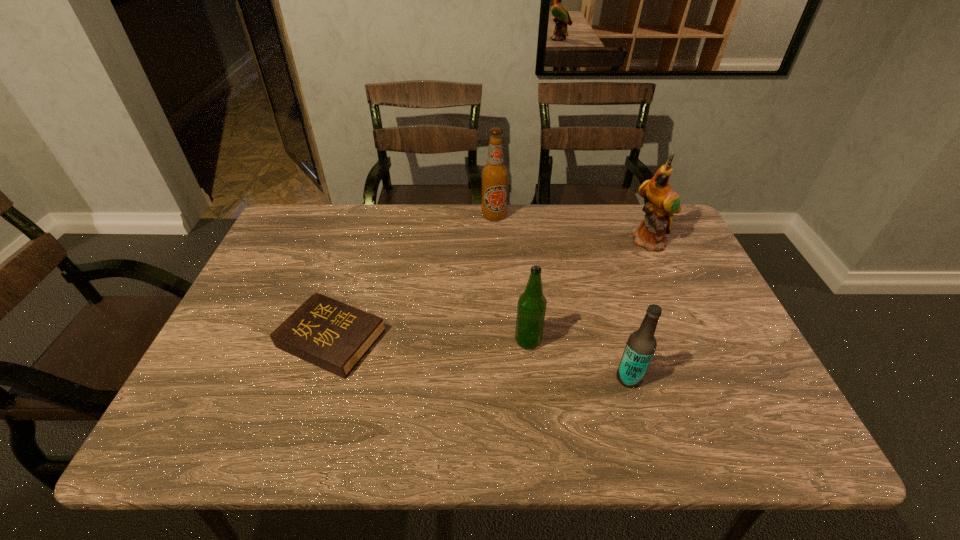
In order to click on empty location between the second farthest beer bottle and the farthest object in this screenshot , I will do `click(511, 278)`.

Find the location of a particular element. This screenshot has width=960, height=540. free space between the parrot and the rightmost beer bottle is located at coordinates (640, 310).

Find the location of a particular element. free space that is in between the parrot and the farthest beer bottle is located at coordinates (572, 229).

You are a GUI agent. You are given a task and a screenshot of the screen. Output one action in this format:
    pyautogui.click(x=<x>, y=<y>)
    Task: Click on the free space between the fourth nearest object and the tallest beer bottle
    
    Given the screenshot: What is the action you would take?
    pyautogui.click(x=572, y=229)

Find the location of `vacant point located between the hardback book and the second nearest beer bottle`. vacant point located between the hardback book and the second nearest beer bottle is located at coordinates (430, 340).

The image size is (960, 540). Find the location of `vacant area that lies between the second object from right to left and the farthest object`. vacant area that lies between the second object from right to left and the farthest object is located at coordinates (562, 297).

Find the location of a particular element. This screenshot has width=960, height=540. vacant area between the tallest beer bottle and the hardback book is located at coordinates (413, 277).

This screenshot has width=960, height=540. I want to click on free spot between the tallest beer bottle and the leftmost object, so click(413, 277).

Identify which object is the third nearest to the second farthest beer bottle. Please provide its 2D coordinates. Your answer should be formatted as a tuple, i.e. [(x, y)], where the tuple contains the x and y coordinates of a point satisfying the conditions above.

[(663, 202)]

The image size is (960, 540). In order to click on the second closest object to the rightmost beer bottle in this screenshot , I will do `click(663, 202)`.